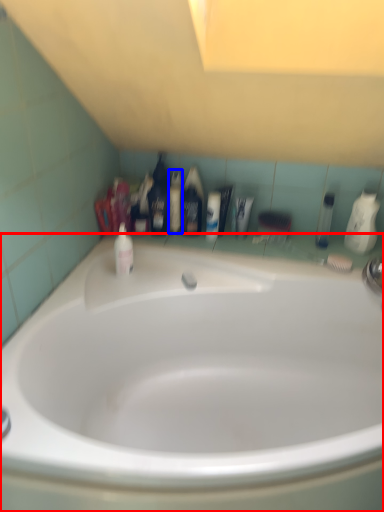
Question: Which point is closer to the camera, bathtub (highlighted by a red box) or mouthwash (highlighted by a blue box)?

Choices:
 (A) bathtub
 (B) mouthwash

Answer: (A)